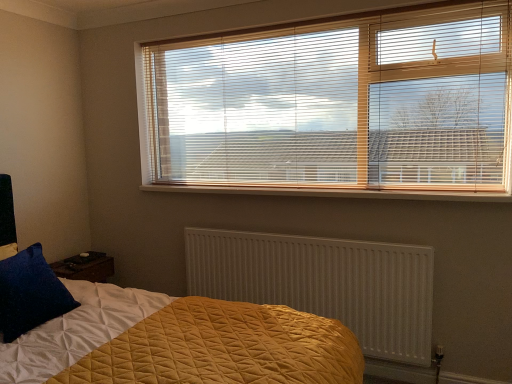
Image resolution: width=512 pixels, height=384 pixels. What do you see at coordinates (30, 293) in the screenshot?
I see `velvety blue pillow at lower left` at bounding box center [30, 293].

Where is `wooden at center`? The height and width of the screenshot is (384, 512). wooden at center is located at coordinates (337, 192).

Measure the distance between white textured radiator at center and camera.

white textured radiator at center and camera are 2.29 meters apart from each other.

Identify the location of wooden blinds at upper center. (335, 104).

Does wooden blinds at upper center have a greater width compared to velvety blue pillow at lower left?

Indeed, wooden blinds at upper center has a greater width compared to velvety blue pillow at lower left.

From the image's perspective, is wooden blinds at upper center above velvety blue pillow at lower left?

Correct, wooden blinds at upper center appears higher than velvety blue pillow at lower left in the image.

Who is shorter, wooden blinds at upper center or velvety blue pillow at lower left?

Standing shorter between the two is velvety blue pillow at lower left.

This screenshot has height=384, width=512. In order to click on pillow on the left of wooden blinds at upper center in this screenshot , I will do `click(30, 293)`.

Is wooden at center a part of wooden blinds at upper center?

That's correct, wooden at center is inside wooden blinds at upper center.

Find the location of a particular element. The width and height of the screenshot is (512, 384). window blind that is above the wooden at center (from a real-world perspective) is located at coordinates (335, 104).

Is wooden blinds at upper center positioned behind wooden at center?

That is False.

Is wooden blinds at upper center aimed at wooden at center?

No, wooden blinds at upper center is not turned towards wooden at center.

Who is taller, wooden at center or white textured radiator at center?

white textured radiator at center.

Is wooden at center smaller than white textured radiator at center?

Indeed, wooden at center has a smaller size compared to white textured radiator at center.

Is wooden at center positioned behind white textured radiator at center?

No, wooden at center is closer to the viewer.

Is wooden at center wider than white textured radiator at center?

Indeed, wooden at center has a greater width compared to white textured radiator at center.

Can you confirm if velvety blue pillow at lower left is positioned to the left of wooden blinds at upper center?

Yes.

Is velvety blue pillow at lower left bigger than wooden blinds at upper center?

No.

Is point (41, 267) closer or farther from the camera than point (293, 27)?

Point (41, 267) appears to be closer to the viewer than point (293, 27).

Is velvety blue pillow at lower left positioned far away from wooden blinds at upper center?

Absolutely, velvety blue pillow at lower left is distant from wooden blinds at upper center.

Considering the relative sizes of wooden at center and wooden blinds at upper center in the image provided, is wooden at center wider than wooden blinds at upper center?

Indeed, wooden at center has a greater width compared to wooden blinds at upper center.

Is wooden at center turned away from wooden blinds at upper center?

No, wooden at center is not facing away from wooden blinds at upper center.

Which is closer, [485,201] or [325,131]?

Clearly, point [485,201] is closer to the camera than point [325,131].

The image size is (512, 384). What are the coordinates of `window sill located above the white textured radiator at center (from a real-world perspective)` in the screenshot? It's located at (337, 192).

Between point (258, 236) and point (156, 185), which one is positioned behind?

The point (156, 185) is farther.

How far apart are white textured radiator at center and wooden at center?

The distance of white textured radiator at center from wooden at center is 19.71 inches.

Does white textured radiator at center have a larger size compared to wooden at center?

Yes, white textured radiator at center is bigger than wooden at center.

Based on the photo, in the image, is velvety blue pillow at lower left positioned in front of or behind wooden at center?

velvety blue pillow at lower left is positioned closer to the viewer than wooden at center.

Would you consider velvety blue pillow at lower left to be distant from wooden at center?

Yes.

Could you tell me if velvety blue pillow at lower left is turned towards wooden at center?

No, velvety blue pillow at lower left does not turn towards wooden at center.

What are the coordinates of `window blind on the right of velvety blue pillow at lower left` in the screenshot? It's located at (335, 104).

The height and width of the screenshot is (384, 512). Identify the location of window blind in front of the wooden at center. (335, 104).

Looking at the image, which one is located further to velvety blue pillow at lower left, wooden at center or white textured radiator at center?

Among the two, wooden at center is located further to velvety blue pillow at lower left.

Which object lies nearer to the anchor point wooden at center, white textured radiator at center or wooden blinds at upper center?

Among the two, white textured radiator at center is located nearer to wooden at center.

Based on their spatial positions, is wooden at center or velvety blue pillow at lower left closer to white textured radiator at center?

wooden at center lies closer to white textured radiator at center than the other object.

Which object lies further to the anchor point white textured radiator at center, wooden blinds at upper center or wooden at center?

wooden blinds at upper center lies further to white textured radiator at center than the other object.

When comparing their distances from velvety blue pillow at lower left, does wooden blinds at upper center or wooden at center seem closer?

Among the two, wooden at center is located nearer to velvety blue pillow at lower left.

Which object lies further to the anchor point wooden at center, wooden blinds at upper center or white textured radiator at center?

Among the two, wooden blinds at upper center is located further to wooden at center.

From the picture: When comparing their distances from wooden at center, does velvety blue pillow at lower left or wooden blinds at upper center seem further?

velvety blue pillow at lower left is further to wooden at center.

Which object lies nearer to the anchor point wooden at center, wooden blinds at upper center or velvety blue pillow at lower left?

wooden blinds at upper center is positioned closer to the anchor wooden at center.

The image size is (512, 384). What are the coordinates of `window sill between wooden blinds at upper center and white textured radiator at center in the vertical direction` in the screenshot? It's located at (337, 192).

Locate an element on the screen. This screenshot has height=384, width=512. radiator between velvety blue pillow at lower left and wooden blinds at upper center is located at coordinates (324, 283).

At what (x,y) coordinates should I click in order to perform the action: click on window blind between velvety blue pillow at lower left and wooden at center in the horizontal direction. Please return your answer as a coordinate pair (x, y). Looking at the image, I should click on (335, 104).

Find the location of a particular element. radiator between velvety blue pillow at lower left and wooden at center is located at coordinates (324, 283).